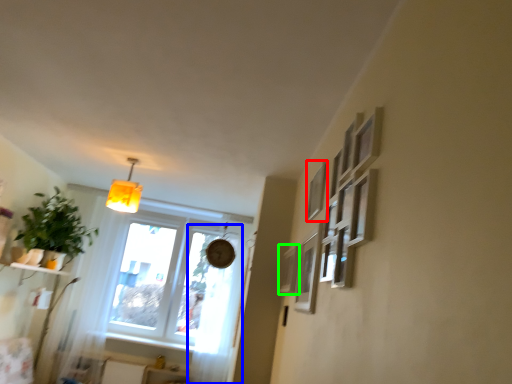
Question: Based on their relative distances, which object is farther from picture frame (highlighted by a red box)? Choose from curtain (highlighted by a blue box) and picture frame (highlighted by a green box).

Choices:
 (A) curtain
 (B) picture frame

Answer: (A)